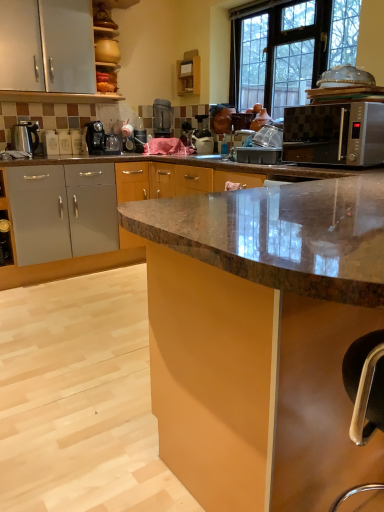
Where is `free spot above metallic silver kettle at left (from a real-world perspective)`? free spot above metallic silver kettle at left (from a real-world perspective) is located at coordinates (21, 124).